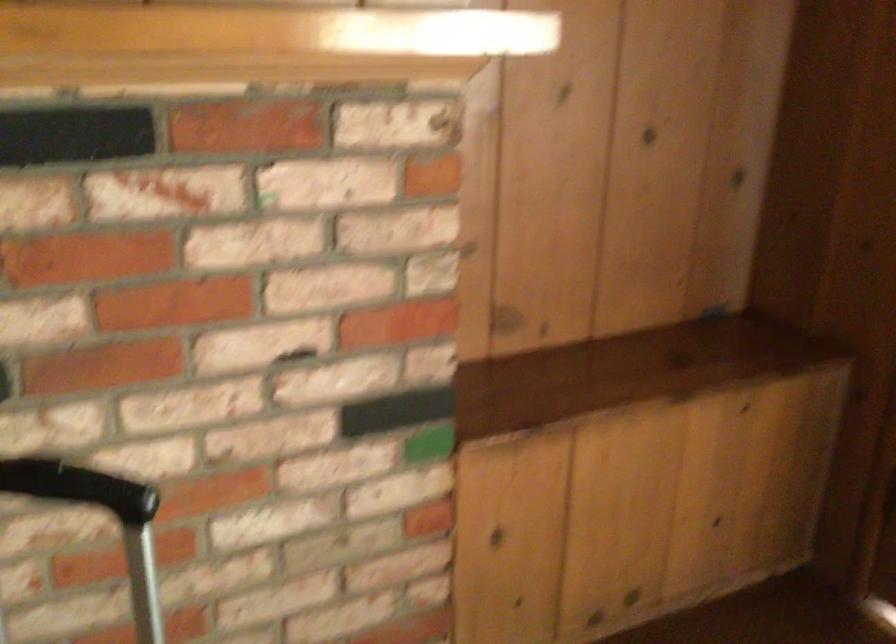
What do you see at coordinates (99, 523) in the screenshot? I see `a black walker handle` at bounding box center [99, 523].